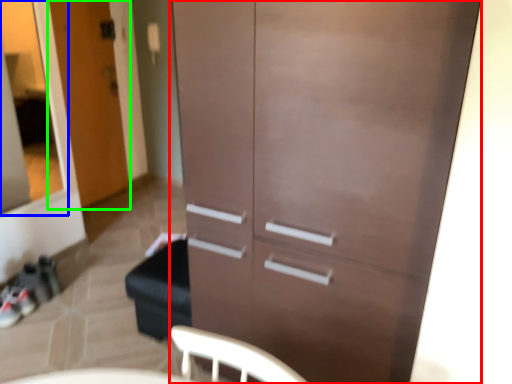
Question: Considering the real-world distances, which object is closest to cupboard (highlighted by a red box)? glass door (highlighted by a blue box) or door (highlighted by a green box).

Choices:
 (A) glass door
 (B) door

Answer: (B)